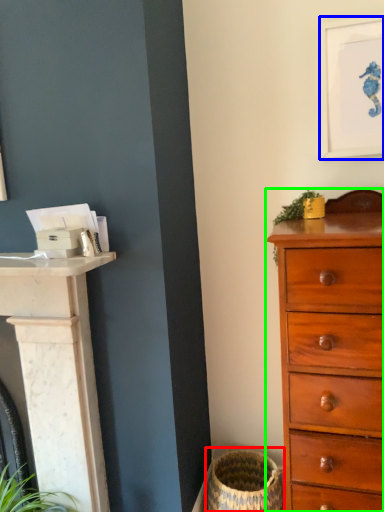
Question: Estimate the real-world distances between objects in this image. Which object is closer to basket container (highlighted by a red box), picture frame (highlighted by a blue box) or chest of drawers (highlighted by a green box)?

Choices:
 (A) picture frame
 (B) chest of drawers

Answer: (B)